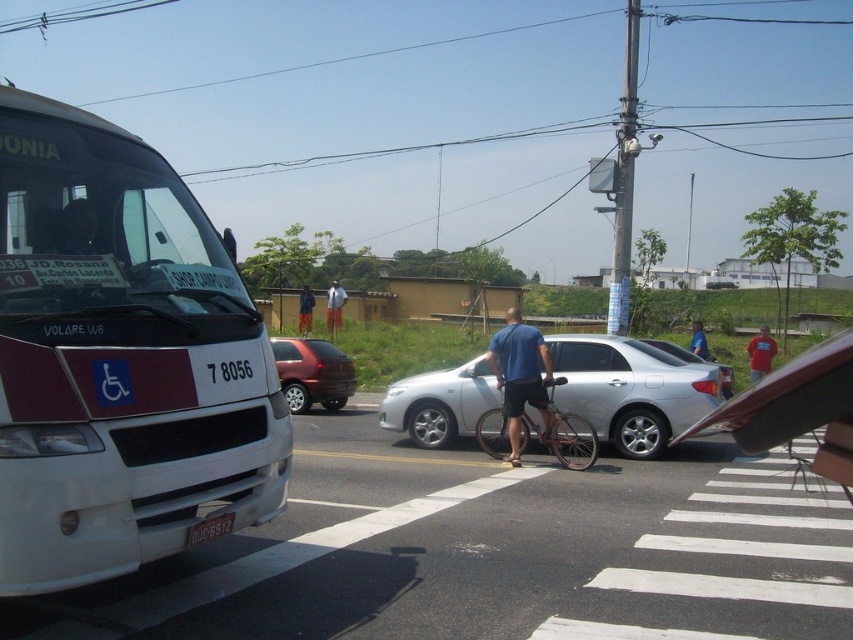
Is point (506, 376) more distant than point (764, 348)?

No, (506, 376) is closer to viewer.

At what (x,y) coordinates should I click in order to perform the action: click on blue matte shirt at center. Please return your answer as a coordinate pair (x, y). The width and height of the screenshot is (853, 640). Looking at the image, I should click on (520, 374).

Can you confirm if metallic maroon suv at center is smaller than blue fabric pants at center?

No.

Who is lower down, metallic maroon suv at center or blue fabric pants at center?

Positioned lower is metallic maroon suv at center.

Which is in front, point (293, 412) or point (306, 316)?

Point (293, 412) is more forward.

You are a GUI agent. You are given a task and a screenshot of the screen. Output one action in this format:
    pyautogui.click(x=<x>, y=<y>)
    Task: Click on the metallic maroon suv at center
    
    Given the screenshot: What is the action you would take?
    (x=312, y=372)

Measure the distance from blue matte shirt at center to light blue shirt at center.

A distance of 15.15 meters exists between blue matte shirt at center and light blue shirt at center.

Is point (521, 324) more distant than point (329, 326)?

No, (521, 324) is in front of (329, 326).

Who is more distant from viewer, (x=509, y=433) or (x=337, y=316)?

The point (x=337, y=316) is more distant.

Locate an element on the screen. This screenshot has height=640, width=853. blue matte shirt at center is located at coordinates (520, 374).